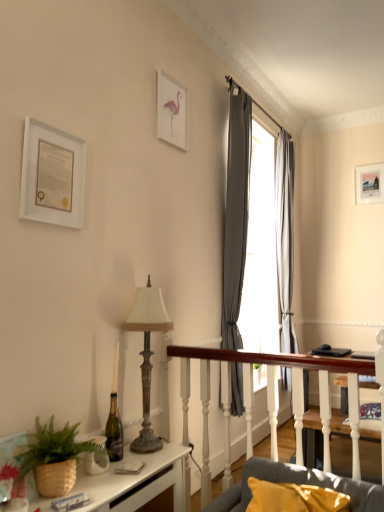
At what (x,y) coordinates should I click in order to perform the action: click on free space underneath brown woven basket at lower left (from a real-world perspective). Please return your answer as a coordinate pair (x, y). The height and width of the screenshot is (512, 384). Looking at the image, I should click on [78, 487].